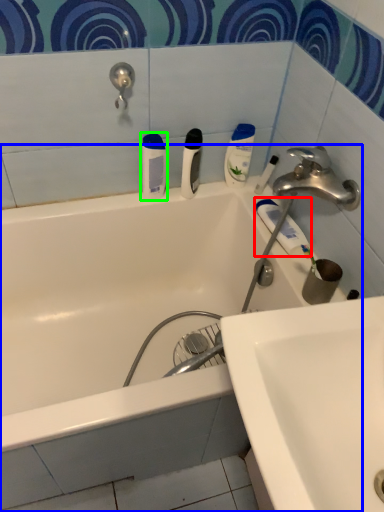
Question: Based on their relative distances, which object is nearer to toothpaste (highlighted by a red box)? Choose from bathtub (highlighted by a blue box) and toiletry (highlighted by a green box).

Choices:
 (A) bathtub
 (B) toiletry

Answer: (B)